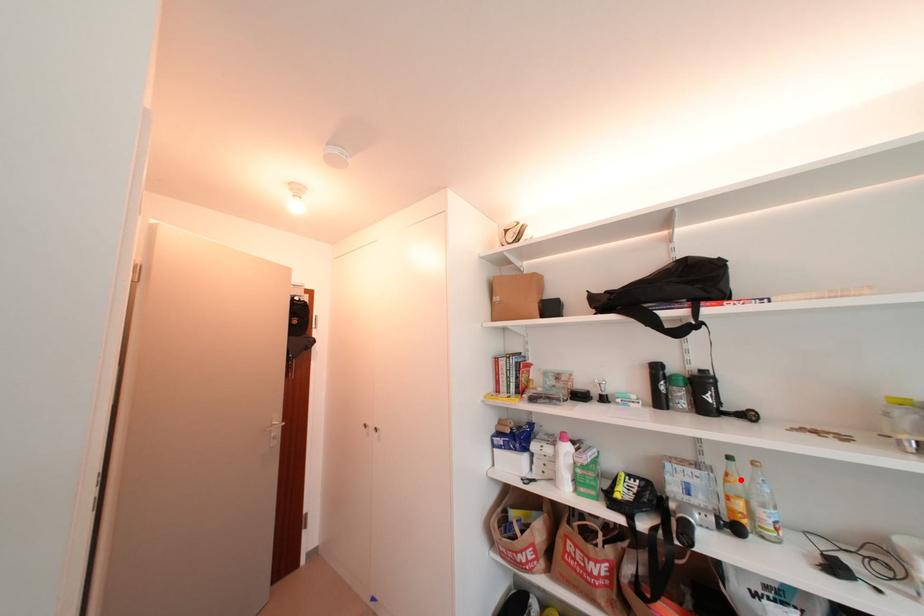
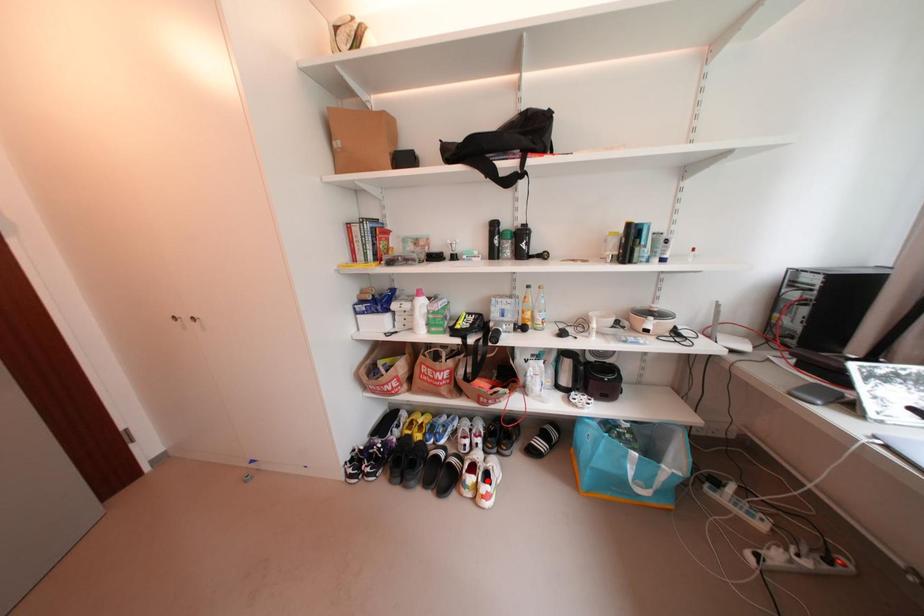
I am providing you with two images of the same scene from different viewpoints. A red point is marked on the first image and another point is marked on the second image. Is the red point in image1 aligned with the point shown in image2?

No